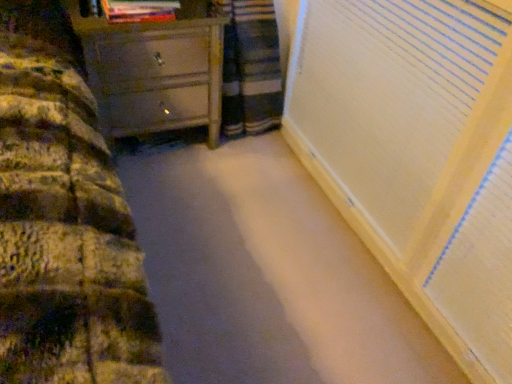
Find the location of a particular element. The height and width of the screenshot is (384, 512). free space in front of matte gray chest of drawers at center is located at coordinates (174, 194).